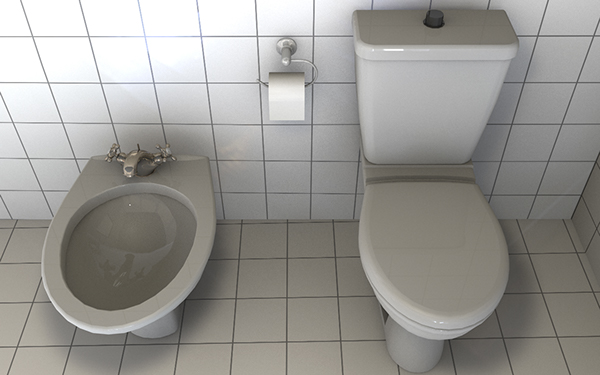
The image size is (600, 375). Identify the location of foundation of the toilet. (412, 350).